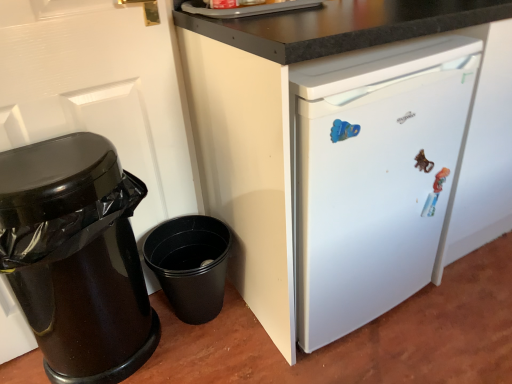
Question: Is black glossy trash can at left to the left of white glossy door at left from the viewer's perspective?

Choices:
 (A) yes
 (B) no

Answer: (B)

Question: From a real-world perspective, is black glossy trash can at left located beneath white glossy door at left?

Choices:
 (A) yes
 (B) no

Answer: (A)

Question: Is black glossy trash can at left far away from white glossy door at left?

Choices:
 (A) no
 (B) yes

Answer: (A)

Question: Is black glossy trash can at left further to the viewer compared to white glossy door at left?

Choices:
 (A) no
 (B) yes

Answer: (B)

Question: Can you confirm if black glossy trash can at left is thinner than white glossy door at left?

Choices:
 (A) yes
 (B) no

Answer: (B)

Question: In terms of height, does white glossy door at left look taller or shorter compared to white matte refrigerator at center?

Choices:
 (A) short
 (B) tall

Answer: (B)

Question: From the image's perspective, is white glossy door at left positioned above or below white matte refrigerator at center?

Choices:
 (A) above
 (B) below

Answer: (B)

Question: From a real-world perspective, is white glossy door at left physically located above or below white matte refrigerator at center?

Choices:
 (A) below
 (B) above

Answer: (B)

Question: Relative to white matte refrigerator at center, is white glossy door at left in front or behind?

Choices:
 (A) front
 (B) behind

Answer: (B)

Question: Would you say white matte refrigerator at center is to the left or to the right of black glossy trash can at left in the picture?

Choices:
 (A) left
 (B) right

Answer: (B)

Question: Considering the positions of white matte refrigerator at center and black glossy trash can at left in the image, is white matte refrigerator at center bigger or smaller than black glossy trash can at left?

Choices:
 (A) small
 (B) big

Answer: (B)

Question: From the image's perspective, is white matte refrigerator at center positioned above or below black glossy trash can at left?

Choices:
 (A) above
 (B) below

Answer: (A)

Question: Is white matte refrigerator at center in front of or behind black glossy trash can at left in the image?

Choices:
 (A) front
 (B) behind

Answer: (A)

Question: In the image, is white matte refrigerator at center positioned in front of or behind white glossy door at left?

Choices:
 (A) front
 (B) behind

Answer: (A)

Question: Is white matte refrigerator at center inside the boundaries of white glossy door at left, or outside?

Choices:
 (A) inside
 (B) outside

Answer: (B)